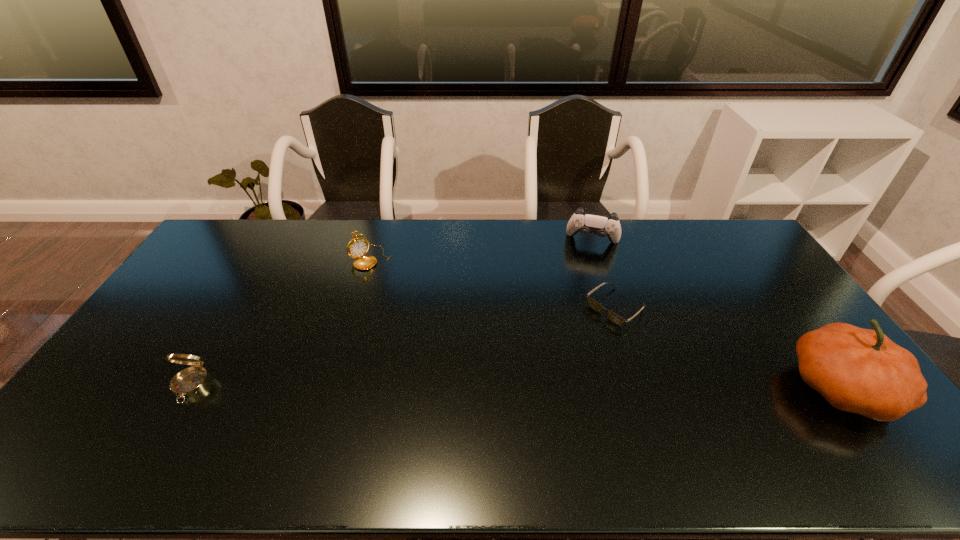
Identify the location of vacant space situated on the face of the second object from left to right. (402, 291).

At what (x,y) coordinates should I click in order to perform the action: click on vacant point located 0.050m on the front-facing side of the third nearest object. Please return your answer as a coordinate pair (x, y). Looking at the image, I should click on (588, 329).

You are a GUI agent. You are given a task and a screenshot of the screen. Output one action in this format:
    pyautogui.click(x=<x>, y=<y>)
    Task: Click on the vacant space located 0.300m on the front-facing side of the third nearest object
    The width and height of the screenshot is (960, 540).
    Given the screenshot: What is the action you would take?
    pyautogui.click(x=530, y=374)

Find the location of a particular element. This screenshot has width=960, height=540. free space located 0.340m on the front-facing side of the third nearest object is located at coordinates (519, 382).

Image resolution: width=960 pixels, height=540 pixels. Identify the location of vacant region located on the front-facing side of the control. (585, 266).

This screenshot has height=540, width=960. I want to click on free location located on the front-facing side of the control, so click(579, 300).

Locate an element on the screen. The width and height of the screenshot is (960, 540). vacant space located on the front-facing side of the control is located at coordinates [x=585, y=266].

At what (x,y) coordinates should I click in order to perform the action: click on pocket watch located in the far edge section of the desktop. Please return your answer as a coordinate pair (x, y). Looking at the image, I should click on (357, 247).

Find the location of a particular element. The height and width of the screenshot is (540, 960). control located at the far edge is located at coordinates (602, 225).

In order to click on compass located at the near edge in this screenshot , I will do `click(190, 381)`.